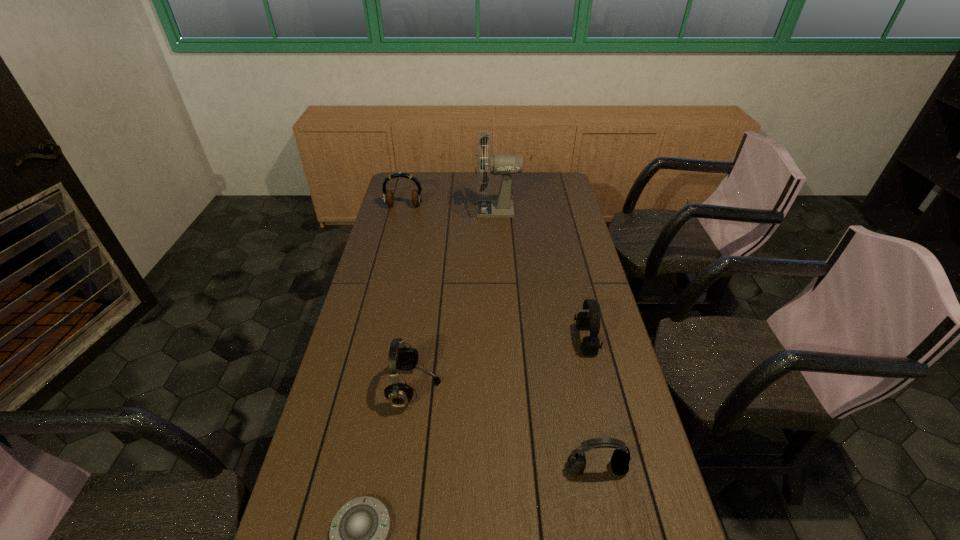
I want to click on object that can be found as the fifth closest to the nearest object, so click(388, 197).

Find the location of `the fifth closest object to the fan`. the fifth closest object to the fan is located at coordinates (358, 531).

You are a GUI agent. You are given a task and a screenshot of the screen. Output one action in this format:
    pyautogui.click(x=<x>, y=<y>)
    Task: Click on the headset identified as the third closest to the fourth object from left to right
    
    Given the screenshot: What is the action you would take?
    click(x=401, y=357)

In order to click on the closest headset to the shortest headset in this screenshot , I will do `click(590, 345)`.

Identify the location of vacant area in the image that satisfies the following two spatial constraints: 1. on the headband of the second farthest headset; 2. on the headband of the shortest headset. (616, 468).